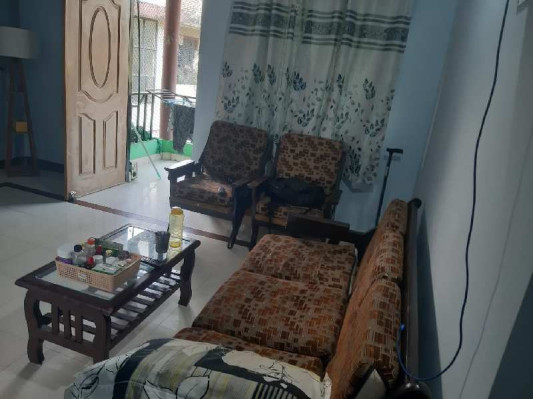
Identify the location of cane leaning up against wall. (384, 192).